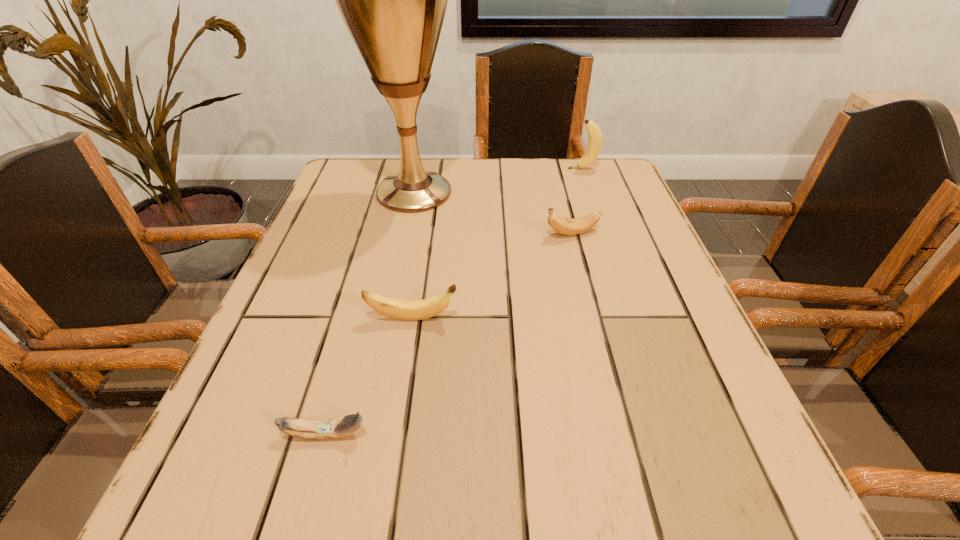
What are the coordinates of `vacant area located 0.160m at the stem of the third farthest banana` in the screenshot? It's located at (550, 318).

You are a GUI agent. You are given a task and a screenshot of the screen. Output one action in this format:
    pyautogui.click(x=<x>, y=<y>)
    Task: Click on the free spot located 0.290m on the front of the third farthest object
    
    Given the screenshot: What is the action you would take?
    pyautogui.click(x=602, y=349)

Locate an element on the screen. Image resolution: width=960 pixels, height=540 pixels. free space located on the peel of the nearest banana is located at coordinates (486, 434).

This screenshot has width=960, height=540. What are the coordinates of `trophy cup present at the far edge` in the screenshot? It's located at click(393, 0).

In order to click on banana at the far edge in this screenshot , I will do `click(594, 145)`.

Identify the location of trophy cup at the left edge. Image resolution: width=960 pixels, height=540 pixels. (393, 0).

Where is `banana positioned at the left edge`? The height and width of the screenshot is (540, 960). banana positioned at the left edge is located at coordinates (336, 427).

I want to click on object situated at the far left corner, so click(393, 0).

This screenshot has height=540, width=960. I want to click on object that is at the far right corner, so click(x=594, y=145).

You are a GUI agent. You are given a task and a screenshot of the screen. Output one action in this format:
    pyautogui.click(x=<x>, y=<y>)
    Task: Click on the vacant area at the far edge of the desktop
    
    Given the screenshot: What is the action you would take?
    pyautogui.click(x=523, y=165)